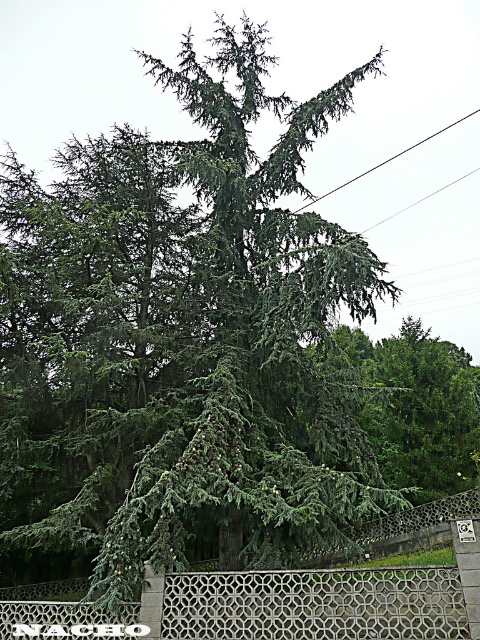
You are a gardener planning to install a new fence. You observe the white textured fence at lower center and the black wire at upper center in the scene. Which object is located below the other?

The white textured fence at lower center is positioned under black wire at upper center, so the white textured fence at lower center is below the black wire at upper center.

You are a painter standing at the base of the large evergreen tree. You want to paint the white textured fence at lower center and the black wire at upper center. Which object is closer to the ground?

The white textured fence at lower center is closer to the ground because it is shorter than the black wire at upper center.

You are a painter setting up your easel to paint the scene of the large evergreen tree. You want to capture both the white textured fence at lower center and the black wire at upper center in your painting. Which object will appear closer to you in the painting?

The white textured fence at lower center will appear closer to you in the painting because it is positioned in front of the black wire at upper center.